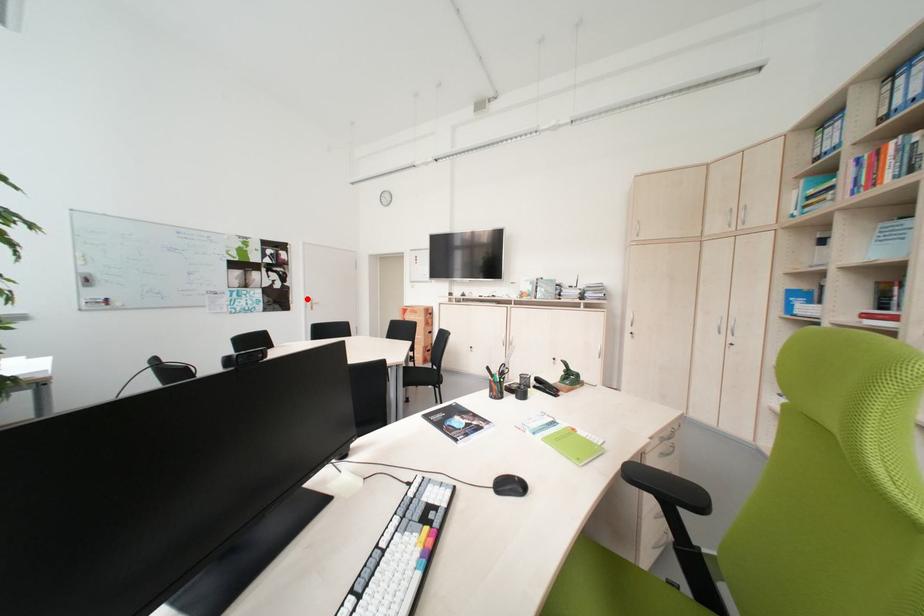
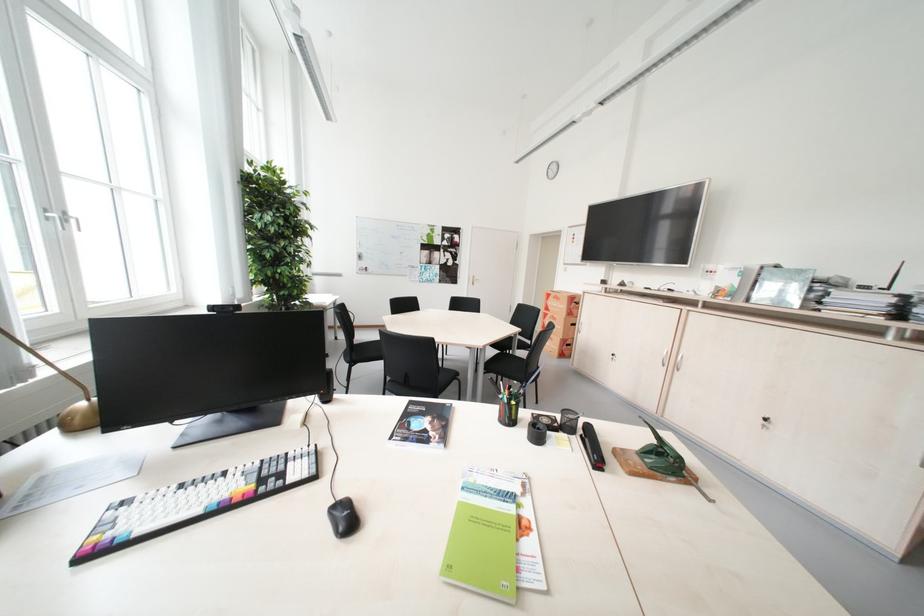
Question: A red point is marked in image1. In image2, is the corresponding 3D point closer to the camera or farther? Reply with the corresponding letter.

Choices:
 (A) The corresponding 3D point is closer.
 (B) The corresponding 3D point is farther.

Answer: (B)